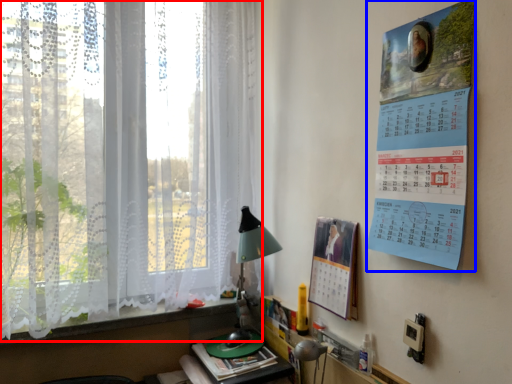
Question: Among these objects, which one is nearest to the camera, window (highlighted by a red box) or poster page (highlighted by a blue box)?

Choices:
 (A) window
 (B) poster page

Answer: (B)